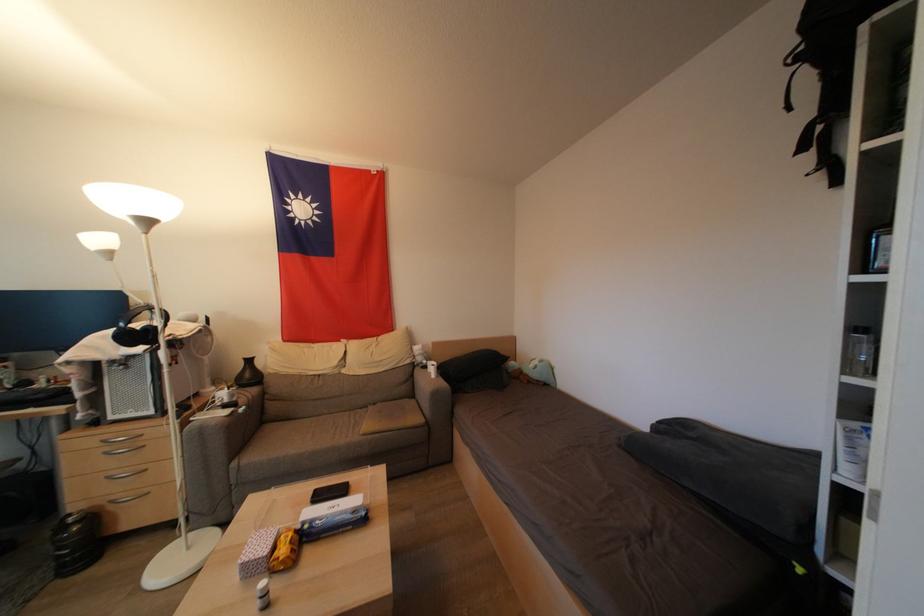
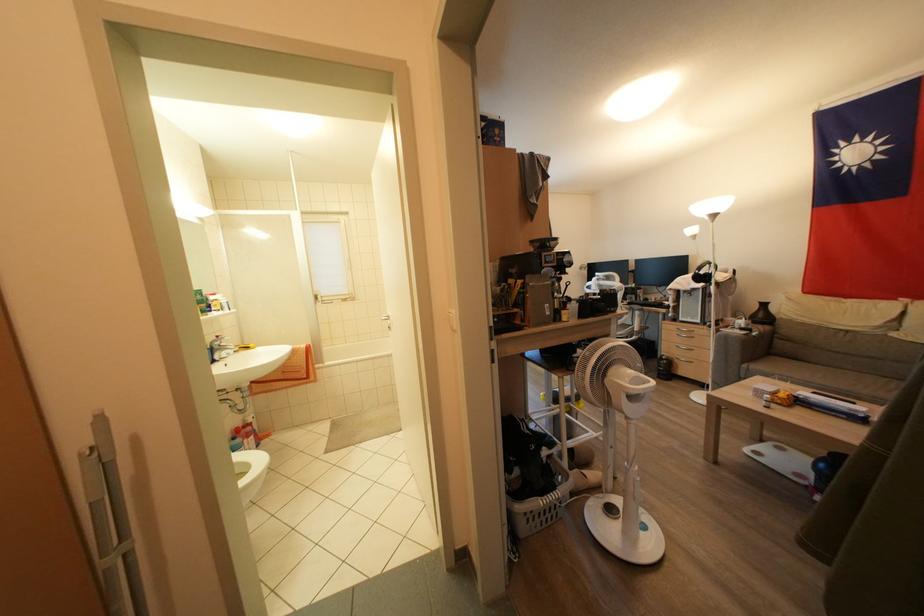
The point at (238,468) is marked in the first image. Where is the corresponding point in the second image?

(748, 370)